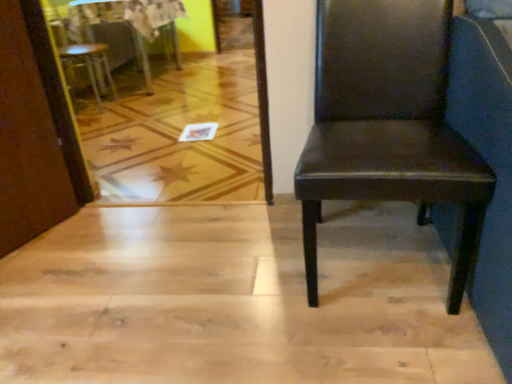
Where is `vacant space underneath matte brown leather chair at right, acting as the 1th chair starting from the right (from a real-world perspective)`? The width and height of the screenshot is (512, 384). vacant space underneath matte brown leather chair at right, acting as the 1th chair starting from the right (from a real-world perspective) is located at coordinates (369, 253).